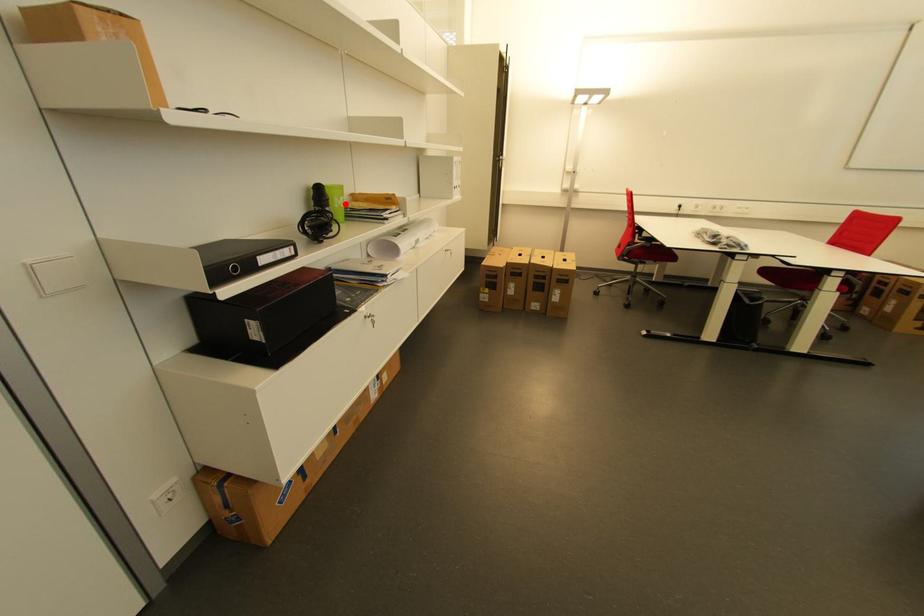
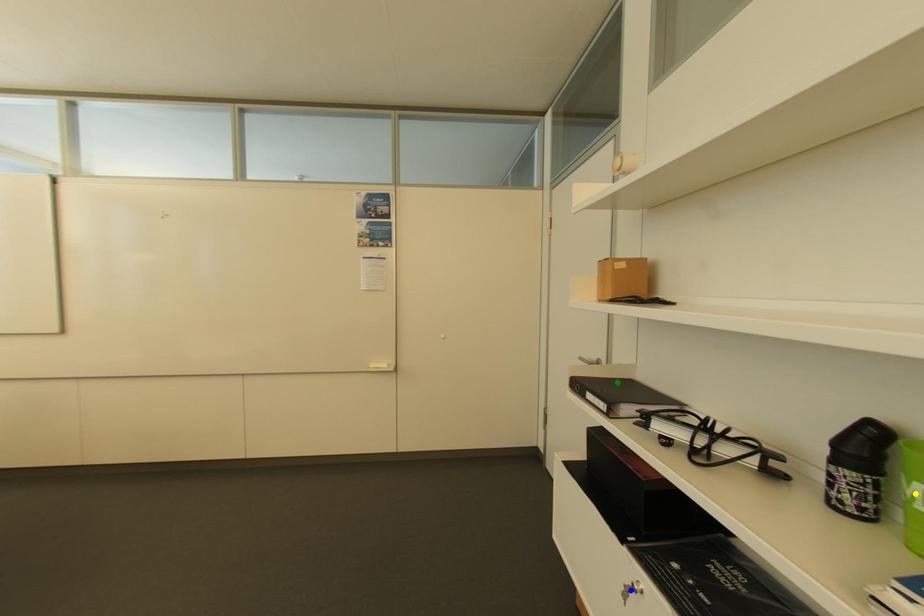
Question: I am providing you with two images of the same scene from different viewpoints. A red point is marked on the first image. You are given multiple points on the second image. Which point in image 2 represents the same 3d spot as the red point in image 1?

Choices:
 (A) yellow point
 (B) green point
 (C) blue point

Answer: (A)